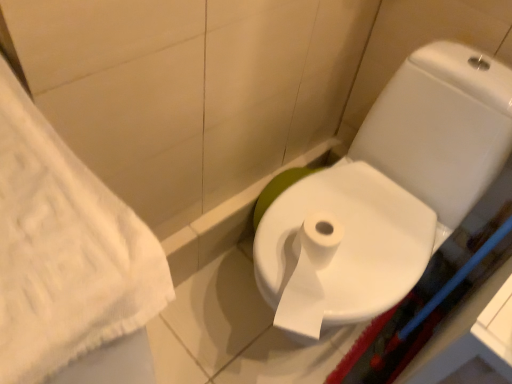
Question: Considering the relative sizes of white paper bidet at center and white glossy toilet at center in the image provided, is white paper bidet at center smaller than white glossy toilet at center?

Choices:
 (A) no
 (B) yes

Answer: (B)

Question: Could you tell me if white paper bidet at center is turned towards white glossy toilet at center?

Choices:
 (A) yes
 (B) no

Answer: (A)

Question: Considering the relative positions of white paper bidet at center and white glossy toilet at center in the image provided, is white paper bidet at center to the left of white glossy toilet at center from the viewer's perspective?

Choices:
 (A) yes
 (B) no

Answer: (A)

Question: Is white paper bidet at center wider than white glossy toilet at center?

Choices:
 (A) no
 (B) yes

Answer: (A)

Question: Considering the relative sizes of white paper bidet at center and white glossy toilet at center in the image provided, is white paper bidet at center taller than white glossy toilet at center?

Choices:
 (A) yes
 (B) no

Answer: (B)

Question: From a real-world perspective, is white paper bidet at center positioned above or below white textured towel at left?

Choices:
 (A) above
 (B) below

Answer: (A)

Question: In terms of height, does white paper bidet at center look taller or shorter compared to white textured towel at left?

Choices:
 (A) short
 (B) tall

Answer: (A)

Question: In the image, is white paper bidet at center positioned in front of or behind white textured towel at left?

Choices:
 (A) behind
 (B) front

Answer: (A)

Question: In the image, is white paper bidet at center on the left side or the right side of white textured towel at left?

Choices:
 (A) right
 (B) left

Answer: (A)

Question: Choose the correct answer: Is white glossy toilet at center inside white paper bidet at center or outside it?

Choices:
 (A) outside
 (B) inside

Answer: (A)

Question: Visually, is white glossy toilet at center positioned to the left or to the right of white paper bidet at center?

Choices:
 (A) left
 (B) right

Answer: (B)

Question: From the image's perspective, relative to white paper bidet at center, is white glossy toilet at center above or below?

Choices:
 (A) below
 (B) above

Answer: (B)

Question: In terms of size, does white glossy toilet at center appear bigger or smaller than white paper bidet at center?

Choices:
 (A) small
 (B) big

Answer: (B)

Question: Considering the positions of point (324, 306) and point (61, 319), is point (324, 306) closer or farther from the camera than point (61, 319)?

Choices:
 (A) closer
 (B) farther

Answer: (B)

Question: From the image's perspective, is white glossy toilet at center positioned above or below white textured towel at left?

Choices:
 (A) above
 (B) below

Answer: (A)